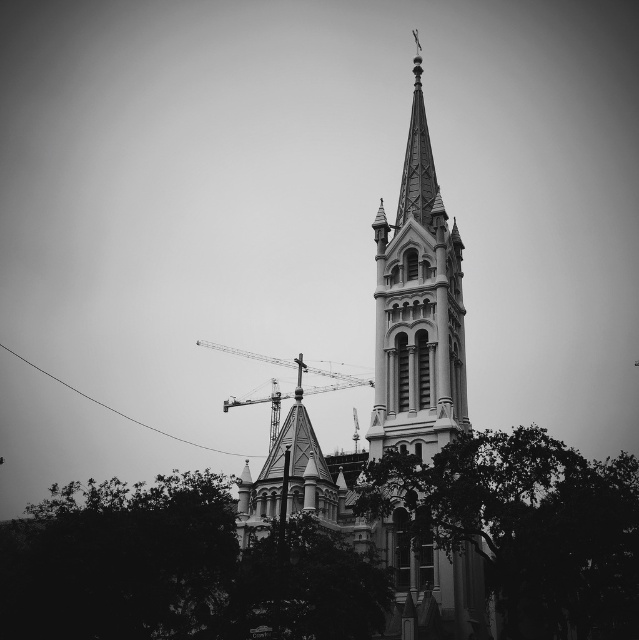
Between green leafy tree at lower right and metallic construction crane at center, which one appears on the right side from the viewer's perspective?

From the viewer's perspective, green leafy tree at lower right appears more on the right side.

What do you see at coordinates (525, 525) in the screenshot?
I see `green leafy tree at lower right` at bounding box center [525, 525].

Who is more distant from viewer, (390, 470) or (245, 355)?

→ Point (245, 355)

You are a GUI agent. You are given a task and a screenshot of the screen. Output one action in this format:
    pyautogui.click(x=<x>, y=<y>)
    Task: Click on the green leafy tree at lower right
    
    Given the screenshot: What is the action you would take?
    pyautogui.click(x=525, y=525)

Which is above, green leafy tree at lower left or polished stone church steeple at center?

polished stone church steeple at center is higher up.

Does green leafy tree at lower left appear over polished stone church steeple at center?

No.

Measure the distance between point (x=93, y=493) and camera.

Point (x=93, y=493) is 87.52 meters from camera.

Locate an element on the screen. This screenshot has width=639, height=640. green leafy tree at lower left is located at coordinates (174, 568).

Which of these two, green leafy tree at lower left or green leafy tree at lower right, stands shorter?

green leafy tree at lower left is shorter.

Between green leafy tree at lower left and green leafy tree at lower right, which one is positioned higher?

green leafy tree at lower right is above.

Who is more forward, (189, 531) or (622, 512)?

Point (622, 512) is in front.

Image resolution: width=639 pixels, height=640 pixels. Find the location of `green leafy tree at lower left`. green leafy tree at lower left is located at coordinates (174, 568).